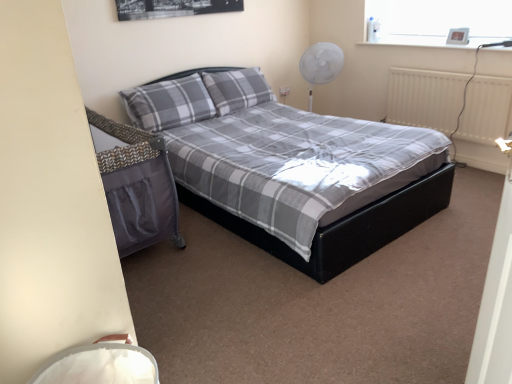
Question: Is metallic digital clock at upper right inside the boundaries of white matte radiator at right, or outside?

Choices:
 (A) inside
 (B) outside

Answer: (B)

Question: Is metallic digital clock at upper right in front of or behind white matte radiator at right in the image?

Choices:
 (A) behind
 (B) front

Answer: (A)

Question: Which of these objects is positioned closest to the gray plaid pillow at center, the 1th pillow from the left?

Choices:
 (A) white plastic fan at upper right
 (B) metallic digital clock at upper right
 (C) white matte radiator at right
 (D) matte black bed at center
 (E) gray plaid pillow at center, the second pillow from the left

Answer: (E)

Question: Which object is the farthest from the metallic digital clock at upper right?

Choices:
 (A) white plastic fan at upper right
 (B) white matte radiator at right
 (C) matte black bed at center
 (D) gray plaid pillow at center, arranged as the second pillow when viewed from the right
 (E) gray plaid pillow at center, which is the first pillow from right to left

Answer: (D)